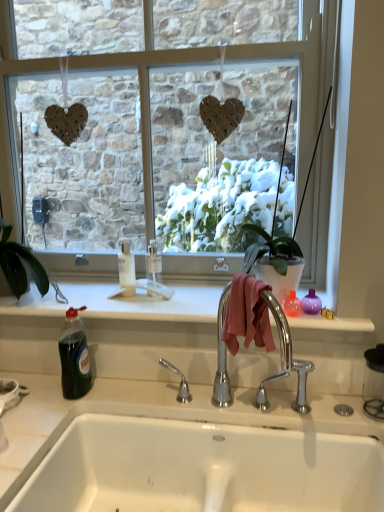
Question: Is clear glass window at center shorter than green glossy houseplant at left?

Choices:
 (A) no
 (B) yes

Answer: (A)

Question: Considering the relative sizes of clear glass window at center and green glossy houseplant at left in the image provided, is clear glass window at center bigger than green glossy houseplant at left?

Choices:
 (A) no
 (B) yes

Answer: (B)

Question: From the image's perspective, is clear glass window at center below green glossy houseplant at left?

Choices:
 (A) yes
 (B) no

Answer: (B)

Question: Does clear glass window at center have a smaller size compared to green glossy houseplant at left?

Choices:
 (A) yes
 (B) no

Answer: (B)

Question: Is clear glass window at center at the left side of green glossy houseplant at left?

Choices:
 (A) no
 (B) yes

Answer: (A)

Question: From a real-world perspective, is clear glass window at center physically below green glossy houseplant at left?

Choices:
 (A) no
 (B) yes

Answer: (A)

Question: Can you confirm if white glossy sink at lower center is smaller than clear glass window at center?

Choices:
 (A) no
 (B) yes

Answer: (B)

Question: Does white glossy sink at lower center have a lesser height compared to clear glass window at center?

Choices:
 (A) no
 (B) yes

Answer: (B)

Question: Is the depth of white glossy sink at lower center greater than that of clear glass window at center?

Choices:
 (A) yes
 (B) no

Answer: (B)

Question: From the image's perspective, would you say white glossy sink at lower center is shown under clear glass window at center?

Choices:
 (A) yes
 (B) no

Answer: (A)

Question: Is white glossy sink at lower center completely or partially outside of clear glass window at center?

Choices:
 (A) yes
 (B) no

Answer: (A)

Question: Is clear glass window at center completely or partially inside white glossy sink at lower center?

Choices:
 (A) yes
 (B) no

Answer: (B)

Question: Is green translucent bottle at lower left facing towards green glossy houseplant at left?

Choices:
 (A) no
 (B) yes

Answer: (A)